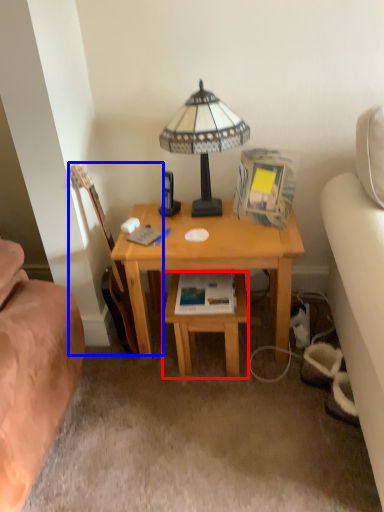
Question: Which of the following is the farthest to the observer, table (highlighted by a red box) or guitar (highlighted by a blue box)?

Choices:
 (A) table
 (B) guitar

Answer: (A)